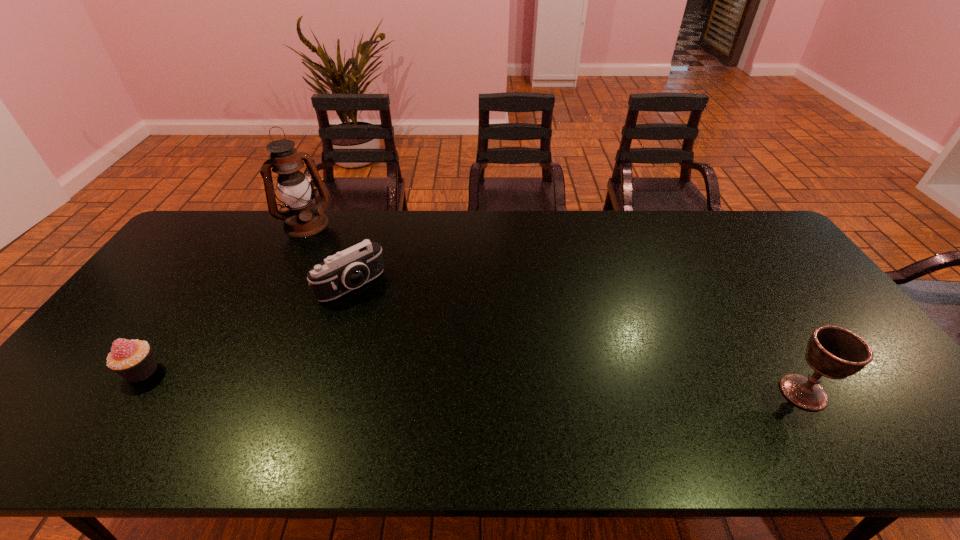
Where is `free space between the tallest object and the second object from right to left`? Image resolution: width=960 pixels, height=540 pixels. free space between the tallest object and the second object from right to left is located at coordinates (328, 254).

This screenshot has height=540, width=960. Identify the location of vacant space that's between the cupcake and the tallest object. (224, 298).

The width and height of the screenshot is (960, 540). What are the coordinates of `vacant space that's between the shortest object and the third object from left to right` in the screenshot? It's located at (247, 328).

You are a GUI agent. You are given a task and a screenshot of the screen. Output one action in this format:
    pyautogui.click(x=<x>, y=<y>)
    Task: Click on the free space between the second object from right to left and the second tallest object
    The width and height of the screenshot is (960, 540).
    Given the screenshot: What is the action you would take?
    pyautogui.click(x=578, y=339)

Find the location of `vacant area that lies between the third object from right to left and the cupcake`. vacant area that lies between the third object from right to left and the cupcake is located at coordinates (224, 298).

Where is `vacant area that lies between the rightmost object and the farthest object`? This screenshot has width=960, height=540. vacant area that lies between the rightmost object and the farthest object is located at coordinates (554, 308).

Where is `object that is the second nearest to the leftmost object`? This screenshot has width=960, height=540. object that is the second nearest to the leftmost object is located at coordinates (302, 219).

Identify which object is the closest to the chalice. Please provide its 2D coordinates. Your answer should be formatted as a tuple, i.e. [(x, y)], where the tuple contains the x and y coordinates of a point satisfying the conditions above.

[(338, 274)]

Identify the location of vacant area in the image that satisfies the following two spatial constraints: 1. on the front side of the camera; 2. on the right side of the rightmost object. (318, 392).

Where is `vacant position in the image that satisfies the following two spatial constraints: 1. on the front side of the leftmost object; 2. on the left side of the chalice`? This screenshot has height=540, width=960. vacant position in the image that satisfies the following two spatial constraints: 1. on the front side of the leftmost object; 2. on the left side of the chalice is located at coordinates (128, 392).